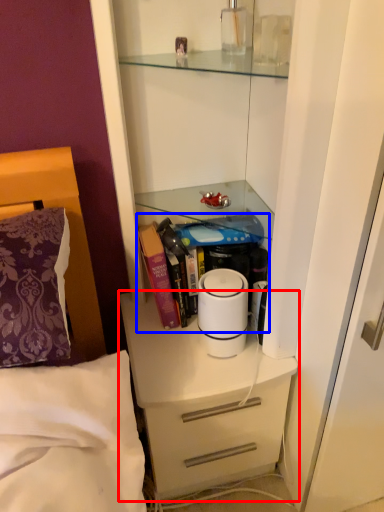
Question: Which object is closer to the camera taking this photo, chest of drawers (highlighted by a red box) or book (highlighted by a blue box)?

Choices:
 (A) chest of drawers
 (B) book

Answer: (A)